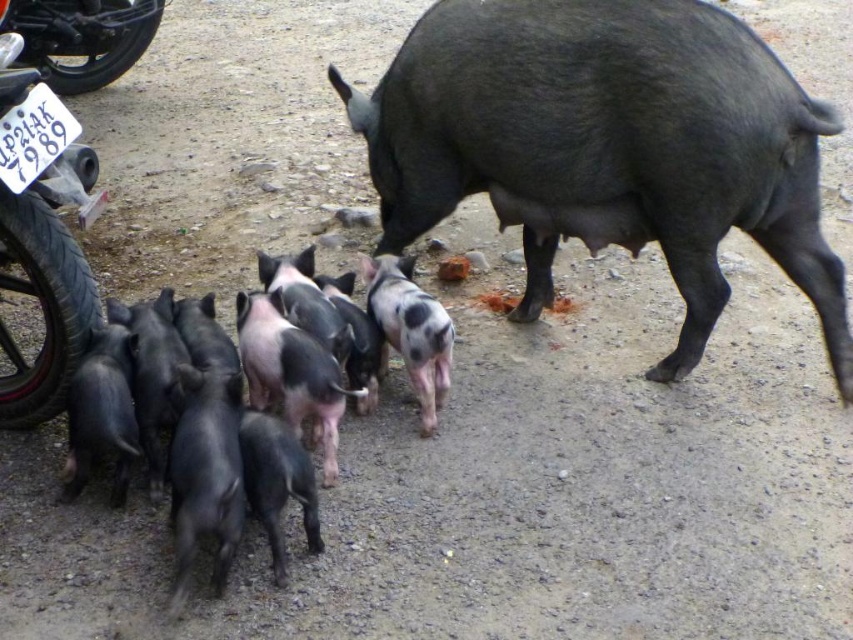
Question: Where is black glossy piglets at center located in relation to speckled fur piglet at center in the image?

Choices:
 (A) above
 (B) below

Answer: (B)

Question: Which object appears closest to the camera in this image?

Choices:
 (A) black rubber tire at left
 (B) shiny black piglet at center
 (C) black rubber tire at lower left

Answer: (A)

Question: Which point is farther to the camera?

Choices:
 (A) black rubber tire at lower left
 (B) black glossy piglets at center
 (C) black rubber tire at left
 (D) speckled fur piglet at center

Answer: (A)

Question: Is shiny black piglet at center to the left of black glossy piglets at center from the viewer's perspective?

Choices:
 (A) yes
 (B) no

Answer: (B)

Question: Observing the image, what is the correct spatial positioning of shiny black piglet at center in reference to black rubber tire at left?

Choices:
 (A) left
 (B) right

Answer: (B)

Question: Which point is closer to the camera?

Choices:
 (A) (370, 269)
 (B) (426, 381)
 (C) (20, 198)
 (D) (817, 234)

Answer: (C)